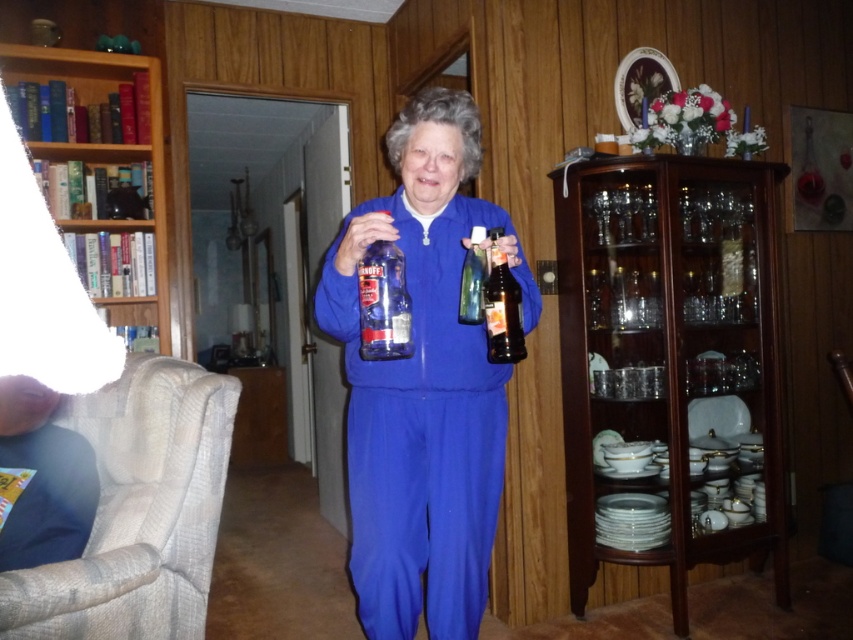
You are a delivery person who needs to place a package on the glass cabinet on the right. The package is 1 meter wide. The point at coordinates (422, 385) is on the blue fabric woman at center. Can you determine if the package will fit on the glass cabinet on the right?

The point at coordinates (422, 385) is on the blue fabric woman at center, but there is no information provided about the dimensions of the glass cabinet on the right. Therefore, it is impossible to determine if the package will fit.

You are standing in the living room and want to place a new vase on the transparent glass cabinet at right. According to the scene description, where exactly should you place the vase?

The transparent glass cabinet at right is located at point (671, 355), so you should place the vase there.

In the scene shown: You are standing in the living room and see two points marked in the image. Which point is closer to you, point (613, 184) or point (508, 324)?

Point (613, 184) is closer to you because it is further to the viewer than point (508, 324).